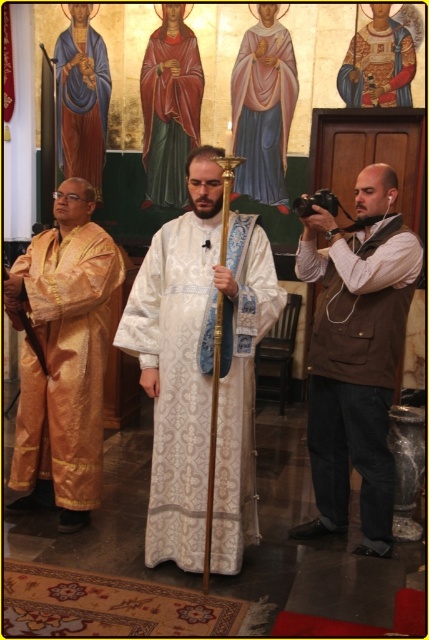
Can you confirm if gold silk robe at left is positioned to the left of blue silk robe at upper left?

In fact, gold silk robe at left is to the right of blue silk robe at upper left.

Can you confirm if gold silk robe at left is smaller than blue silk robe at upper left?

Actually, gold silk robe at left might be larger than blue silk robe at upper left.

I want to click on gold silk robe at left, so click(65, 364).

Is gold silk robe at left behind gold brocade robe at upper center?

No, gold silk robe at left is closer to the viewer.

Between gold silk robe at left and gold brocade robe at upper center, which one is positioned lower?

gold silk robe at left is lower down.

Find the location of a particular element. This screenshot has height=640, width=429. gold silk robe at left is located at coordinates (65, 364).

Where is `gold silk robe at left`? This screenshot has width=429, height=640. gold silk robe at left is located at coordinates (65, 364).

Measure the distance between white embroidered robe at center and pink silk robe at center.

white embroidered robe at center is 3.13 meters away from pink silk robe at center.

Between white embroidered robe at center and pink silk robe at center, which one has more height?

pink silk robe at center

Is point (226, 436) in front of point (253, 64)?

Yes, point (226, 436) is closer to viewer.

The image size is (429, 640). What are the coordinates of `white embroidered robe at center` in the screenshot? It's located at (177, 380).